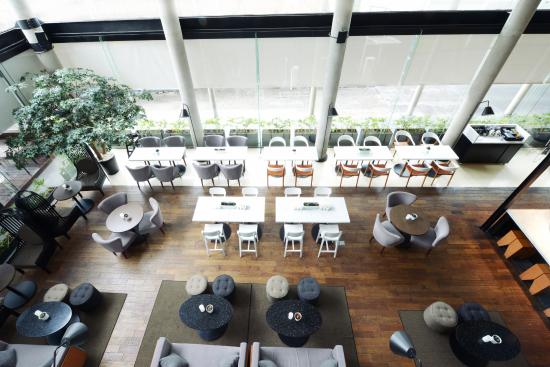
This screenshot has height=367, width=550. Identify the location of lights. (77, 332), (400, 342), (489, 108), (336, 111), (184, 114).